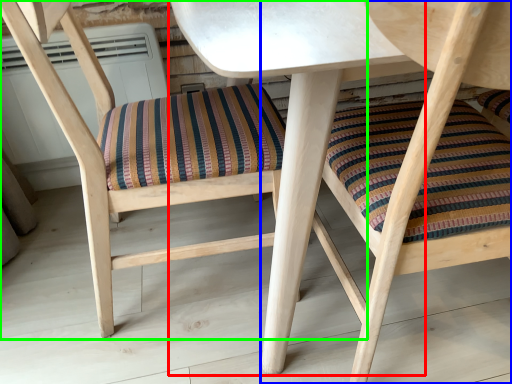
Question: Considering the real-world distances, which object is farthest from table (highlighted by a red box)? chair (highlighted by a blue box) or chair (highlighted by a green box)?

Choices:
 (A) chair
 (B) chair

Answer: (B)